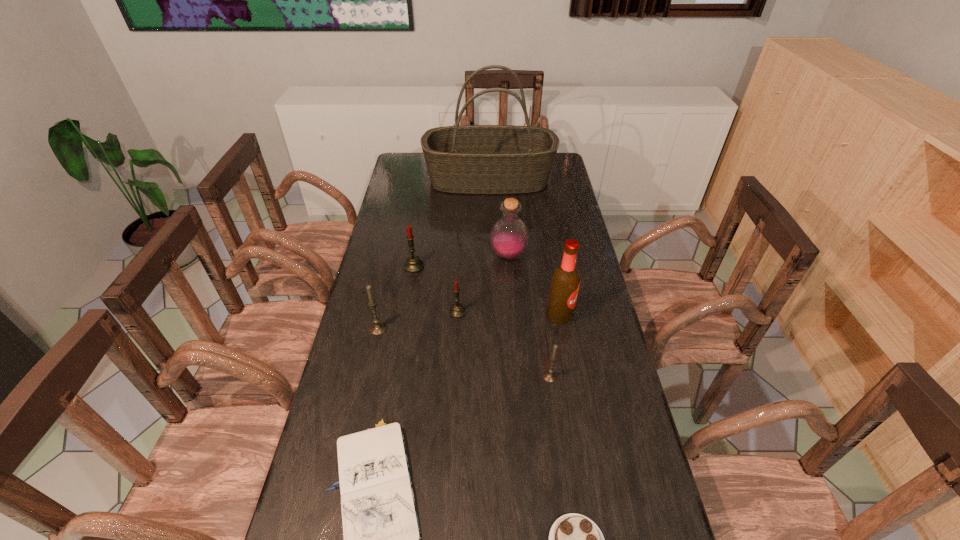
Identify the location of the farthest object. The height and width of the screenshot is (540, 960). (471, 159).

Find the location of a particular element. The image size is (960, 540). the tallest object is located at coordinates (471, 159).

The height and width of the screenshot is (540, 960). What are the coordinates of `the second tallest object` in the screenshot? It's located at (564, 286).

At what (x,y) coordinates should I click in order to perform the action: click on the third tallest object. Please return your answer as a coordinate pair (x, y). Looking at the image, I should click on (509, 236).

What are the coordinates of `purple bottle` in the screenshot? It's located at (509, 236).

Find the location of a particular element. the third candle from right to left is located at coordinates (413, 265).

Where is `the bigger red candle`? The image size is (960, 540). the bigger red candle is located at coordinates (413, 265).

Identify the location of the leftmost candle. (378, 327).

This screenshot has width=960, height=540. I want to click on the bigger gray candle, so click(x=378, y=327).

Identify the location of the smaller red candle. (457, 310).